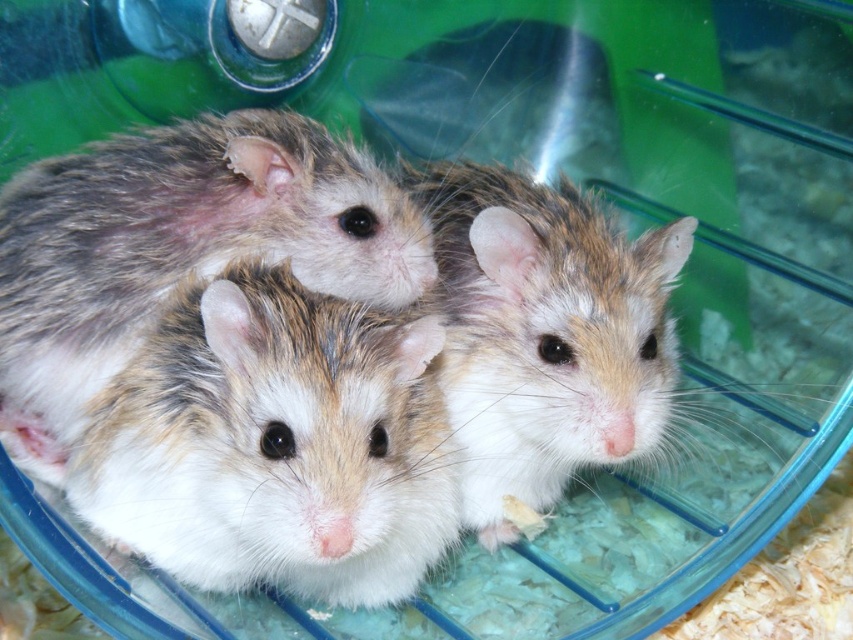
Is fluffy white hamster at center closer to the viewer compared to fuzzy brown hamster at center?

Yes, it is.

Is fluffy white hamster at center thinner than fuzzy brown hamster at center?

Incorrect, fluffy white hamster at center's width is not less than fuzzy brown hamster at center's.

Is point (49, 280) positioned in front of point (544, 205)?

Yes, it is.

This screenshot has height=640, width=853. In order to click on fluffy white hamster at center in this screenshot , I will do `click(177, 248)`.

The width and height of the screenshot is (853, 640). What do you see at coordinates (276, 444) in the screenshot?
I see `fluffy white mouse at center` at bounding box center [276, 444].

Find the location of `fluffy white mouse at center`. fluffy white mouse at center is located at coordinates (276, 444).

Who is more distant from viewer, (247, 371) or (225, 152)?

The point (225, 152) is more distant.

Find the location of a particular element. Image resolution: width=853 pixels, height=640 pixels. fluffy white mouse at center is located at coordinates (276, 444).

Who is positioned more to the left, fluffy white mouse at center or fuzzy brown hamster at center?

fluffy white mouse at center

Does point (386, 554) come farther from viewer compared to point (479, 468)?

No.

Which is behind, point (281, 474) or point (502, 198)?

The point (502, 198) is behind.

In order to click on fluffy white mouse at center in this screenshot , I will do `click(276, 444)`.